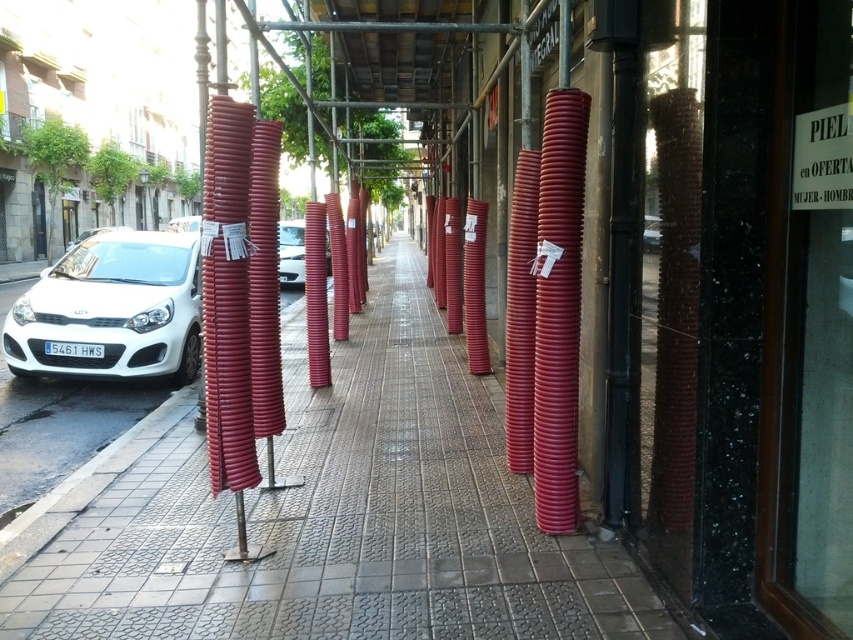
Who is lower down, smooth concrete pavement at center or white matte car at left?

Positioned lower is smooth concrete pavement at center.

Is smooth concrete pavement at center bigger than white matte car at left?

No.

Is point (463, 552) in front of point (160, 364)?

Yes, it is.

The height and width of the screenshot is (640, 853). Find the location of `smooth concrete pavement at center`. smooth concrete pavement at center is located at coordinates (335, 515).

Looking at this image, does metallic silver car at center have a greater width compared to white glossy car at left?

A: In fact, metallic silver car at center might be narrower than white glossy car at left.

Consider the image. Which is above, metallic silver car at center or white glossy car at left?

white glossy car at left is above.

The height and width of the screenshot is (640, 853). Identify the location of metallic silver car at center. (651, 232).

Can you confirm if smooth concrete pavement at center is positioned above white glossy car at center?

No, smooth concrete pavement at center is not above white glossy car at center.

Who is taller, smooth concrete pavement at center or white glossy car at center?

white glossy car at center

Between point (479, 604) and point (303, 264), which one is positioned behind?

The point (303, 264) is more distant.

This screenshot has width=853, height=640. I want to click on smooth concrete pavement at center, so click(335, 515).